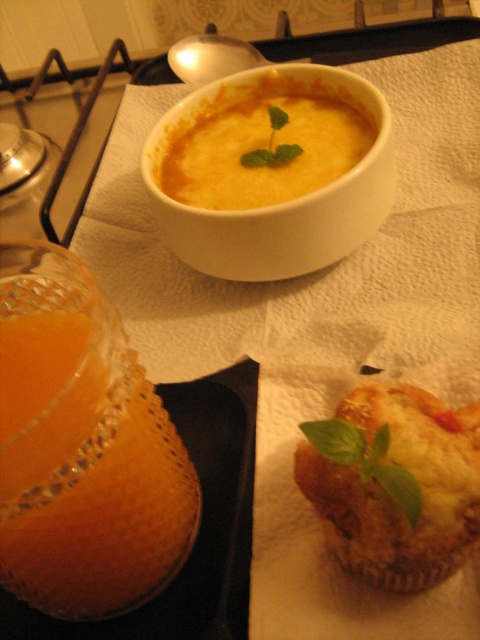
Does yellow matte soup at center have a lesser width compared to green leafy basil at center?

In fact, yellow matte soup at center might be wider than green leafy basil at center.

Is yellow matte soup at center further to the viewer compared to green leafy basil at center?

Yes, yellow matte soup at center is further from the viewer.

Who is more forward, (226, 182) or (382, 456)?

Point (382, 456) is more forward.

Locate an element on the screen. yellow matte soup at center is located at coordinates (262, 145).

Is point (93, 380) farther from viewer compared to point (371, 456)?

No, it is in front of (371, 456).

Find the location of a particular element. translucent glass cup of orange juice at lower left is located at coordinates (85, 472).

I want to click on translucent glass cup of orange juice at lower left, so click(x=85, y=472).

Who is lower down, golden brown muffin at lower right or yellow matte soup at center?

golden brown muffin at lower right

Does golden brown muffin at lower right have a greater width compared to yellow matte soup at center?

Incorrect, golden brown muffin at lower right's width does not surpass yellow matte soup at center's.

This screenshot has width=480, height=640. What do you see at coordinates (395, 483) in the screenshot? I see `golden brown muffin at lower right` at bounding box center [395, 483].

Identify the location of golden brown muffin at lower right. The height and width of the screenshot is (640, 480). (395, 483).